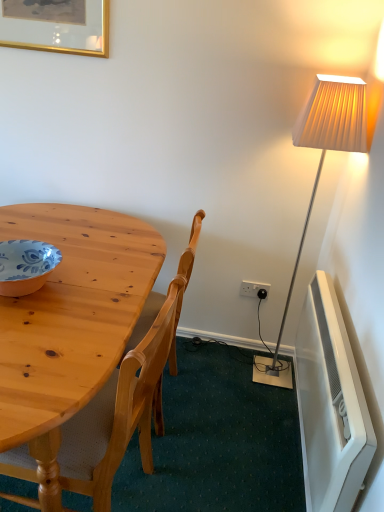
Where is `vacant space underneath white plastic radiator at lower right (from a real-world perspective)`? Image resolution: width=384 pixels, height=512 pixels. vacant space underneath white plastic radiator at lower right (from a real-world perspective) is located at coordinates (296, 455).